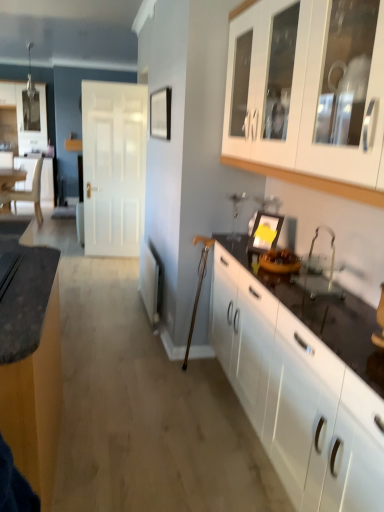
Question: Is matte black countertop at left, which appears as the first cabinetry when viewed from the left, at the right side of wooden table at left?

Choices:
 (A) yes
 (B) no

Answer: (A)

Question: Can you confirm if matte black countertop at left, which is the 3th cabinetry from right to left, is thinner than wooden table at left?

Choices:
 (A) yes
 (B) no

Answer: (A)

Question: Is wooden table at left at the back of matte black countertop at left, which appears as the first cabinetry when viewed from the left?

Choices:
 (A) no
 (B) yes

Answer: (A)

Question: Is matte black countertop at left, which appears as the first cabinetry when viewed from the left, smaller than wooden table at left?

Choices:
 (A) yes
 (B) no

Answer: (B)

Question: Is wooden table at left inside matte black countertop at left, which appears as the first cabinetry when viewed from the left?

Choices:
 (A) no
 (B) yes

Answer: (A)

Question: Does matte black countertop at left, which is the 3th cabinetry from right to left, have a larger size compared to wooden table at left?

Choices:
 (A) yes
 (B) no

Answer: (A)

Question: Can you confirm if white glossy cabinets at right, which is the 2th cabinetry from right to left, is positioned to the right of clear glass sink at lower right?

Choices:
 (A) yes
 (B) no

Answer: (B)

Question: Is white glossy cabinets at right, which is the 2th cabinetry from right to left, taller than clear glass sink at lower right?

Choices:
 (A) no
 (B) yes

Answer: (B)

Question: Considering the relative sizes of white glossy cabinets at right, the 2th cabinetry viewed from the left, and clear glass sink at lower right in the image provided, is white glossy cabinets at right, the 2th cabinetry viewed from the left, shorter than clear glass sink at lower right?

Choices:
 (A) yes
 (B) no

Answer: (B)

Question: Is clear glass sink at lower right inside white glossy cabinets at right, which is the 2th cabinetry from right to left?

Choices:
 (A) yes
 (B) no

Answer: (B)

Question: From the image's perspective, would you say white glossy cabinets at right, the 2th cabinetry viewed from the left, is positioned over clear glass sink at lower right?

Choices:
 (A) yes
 (B) no

Answer: (B)

Question: Is white glossy cabinets at right, the 2th cabinetry viewed from the left, facing towards clear glass sink at lower right?

Choices:
 (A) no
 (B) yes

Answer: (A)

Question: Is white glossy cabinet at upper right, marked as the 3th cabinetry in a left-to-right arrangement, aimed at yellow paper at center?

Choices:
 (A) yes
 (B) no

Answer: (B)